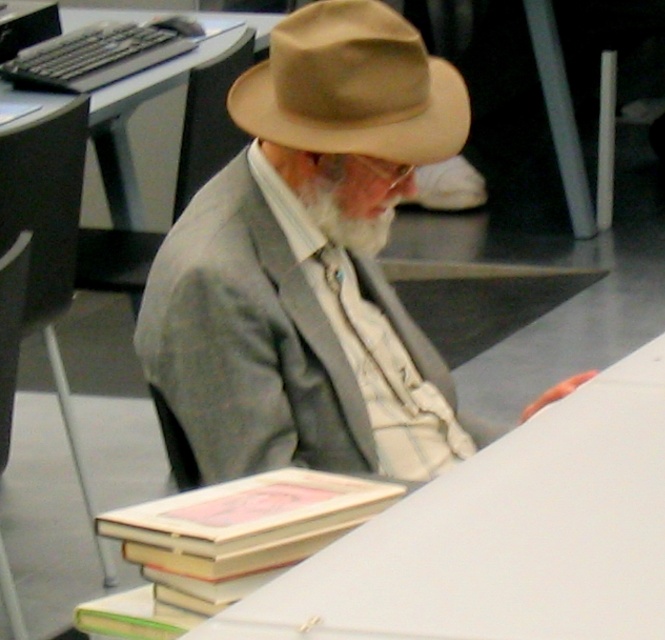
You are a photographer taking a portrait of the man in the scene. You want to ensure both the tan felt fedora at center and the white soft beard at center are clearly visible. Given their positions, which one might be more challenging to capture in focus due to its height?

The tan felt fedora at center is taller than the white soft beard at center, so the tan felt fedora at center might be more challenging to capture in focus because it is taller and could be further away from the focal plane.

You are a librarian who needs to place a new book on the table. The table has limited space between the light brown felt hat at center and the hardcover book at lower center. What is the minimum distance you need to leave between them to ensure the new book fits?

The light brown felt hat at center and hardcover book at lower center are 19.09 inches apart from each other. To ensure the new book fits, you should leave at least 19.09 inches between them.